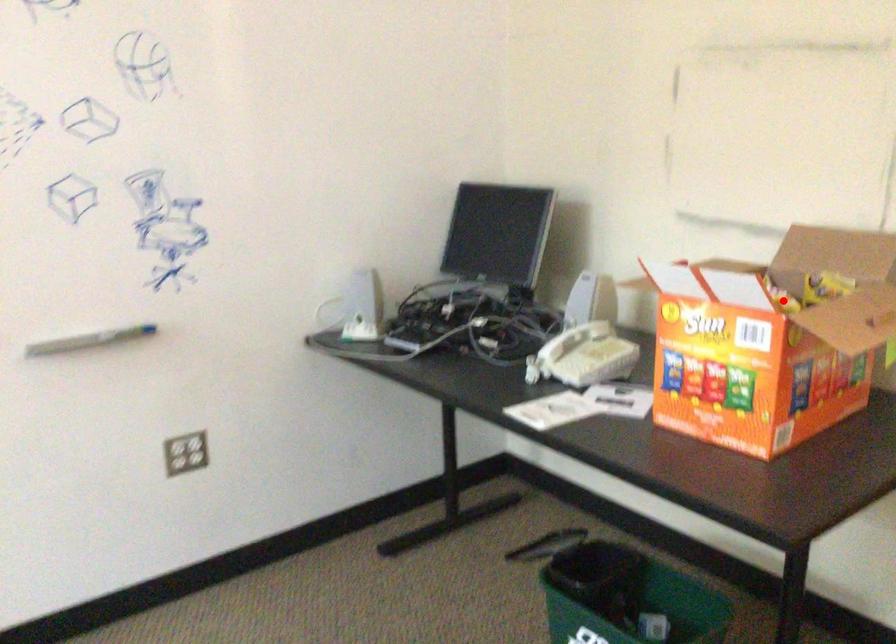
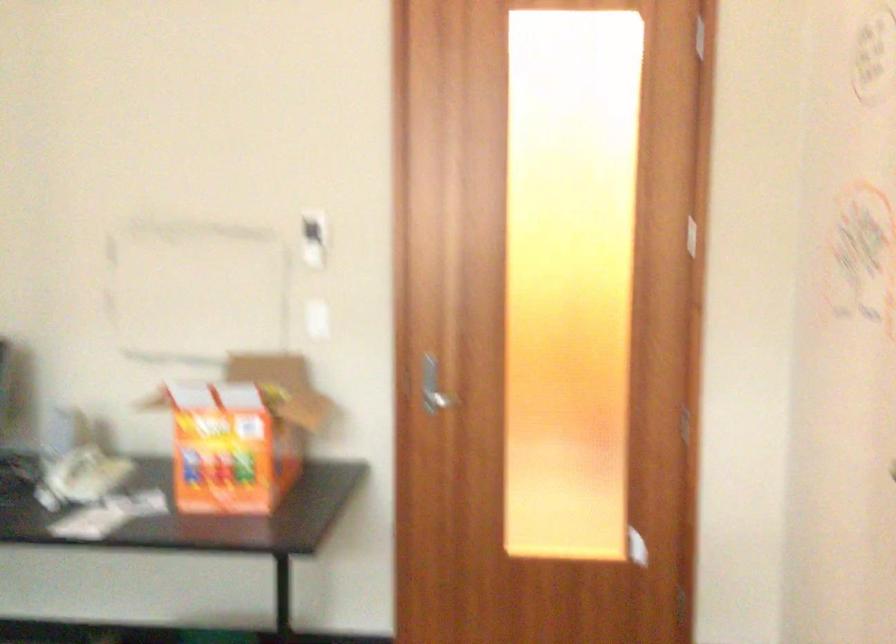
Question: I am providing you with two images of the same scene from different viewpoints. A red point is shown in image1. For the corresponding object point in image2, is it positioned nearer or farther from the camera?

Choices:
 (A) Nearer
 (B) Farther

Answer: (B)